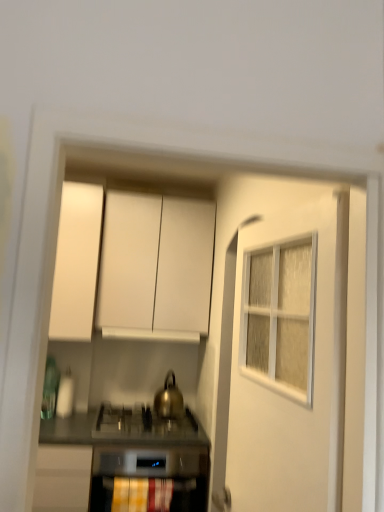
Question: In terms of size, does yellow fabric curtain at lower center appear bigger or smaller than gold metallic kettle at center?

Choices:
 (A) small
 (B) big

Answer: (A)

Question: Considering the relative positions of yellow fabric curtain at lower center and gold metallic kettle at center in the image provided, is yellow fabric curtain at lower center to the left or to the right of gold metallic kettle at center?

Choices:
 (A) left
 (B) right

Answer: (A)

Question: Which object is the closest to the metallic stainless steel countertop at center?

Choices:
 (A) yellow fabric curtain at lower center
 (B) white matte cabinet at upper center, the second cabinetry when ordered from left to right
 (C) gold metallic kettle at center
 (D) white textured door at center
 (E) white matte vent at center

Answer: (A)

Question: Which of these objects is positioned closest to the gold metallic kettle at center?

Choices:
 (A) yellow fabric curtain at lower center
 (B) white matte cabinet at upper center, arranged as the 1th cabinetry when viewed from the right
 (C) metallic stainless steel countertop at center
 (D) white matte vent at center
 (E) white textured door at center

Answer: (E)